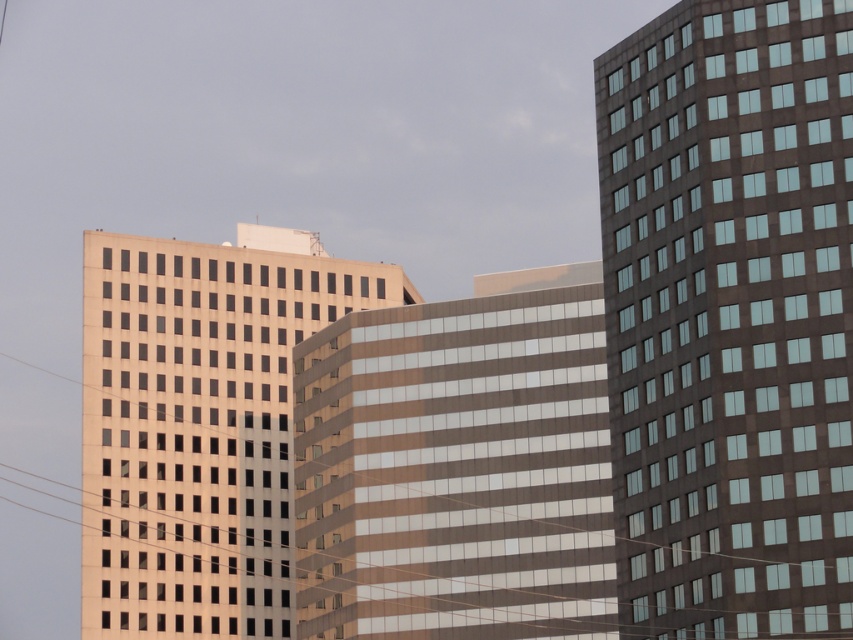
Question: Which of these objects is positioned farthest from the dark glass building at right?

Choices:
 (A) matte glass building at center
 (B) brown glass building at center

Answer: (A)

Question: Can you confirm if dark glass building at right is smaller than matte glass building at center?

Choices:
 (A) no
 (B) yes

Answer: (B)

Question: Does dark glass building at right appear on the right side of brown glass building at center?

Choices:
 (A) no
 (B) yes

Answer: (B)

Question: Estimate the real-world distances between objects in this image. Which object is closer to the dark glass building at right?

Choices:
 (A) brown glass building at center
 (B) matte glass building at center

Answer: (A)

Question: Which object is the farthest from the brown glass building at center?

Choices:
 (A) dark glass building at right
 (B) matte glass building at center

Answer: (B)

Question: Can you confirm if dark glass building at right is bigger than brown glass building at center?

Choices:
 (A) no
 (B) yes

Answer: (A)